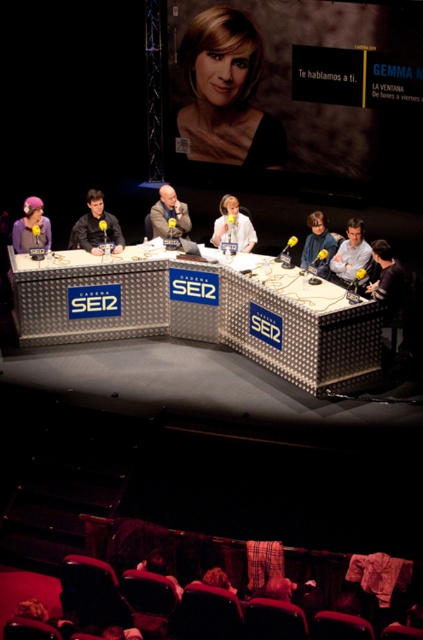
You are a camera operator in the studio. You need to pan your camera from the smooth blonde hair at upper center to the white matte jacket at center. In which direction should you move the camera?

The smooth blonde hair at upper center is to the left of the white matte jacket at center, so you should pan the camera to the right to move from the smooth blonde hair at upper center to the white matte jacket at center.

You are a stagehand in a studio and need to place a new microphone exactly 0.1 units to the right of the smooth gray jacket at center. What are the coordinates where you should place the new microphone?

The smooth gray jacket at center is located at coordinates (170, 214). Adding 0.1 to the x coordinate gives 0.436. The new microphone should be placed at coordinates (170, 278).

You are a stagehand preparing to adjust the lighting for the panelists. You need to position a spotlight on the matte black jacket at center and another on the matte purple wig at left. Based on their positions, which spotlight should you move first to avoid blocking the other?

The matte purple wig at left is to the left of the matte black jacket at center. Since the matte purple wig is positioned further left, you should adjust its spotlight first to avoid blocking the path needed for the spotlight aimed at the matte black jacket at center.